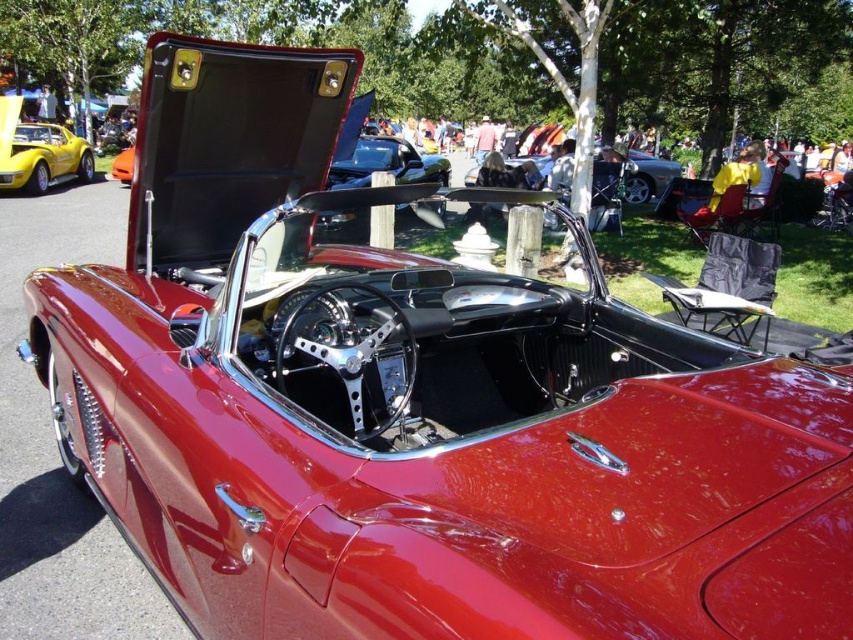
You are a photographer at the car show and want to capture both the shiny yellow convertible at left and the shiny black convertible at center in a single wide shot. Given their sizes, will you need to adjust your camera angle to include both?

The shiny yellow convertible at left occupies less space than the shiny black convertible at center. To capture both in a single wide shot, you may need to adjust your camera angle to accommodate the larger size of the shiny black convertible at center.

You are a photographer at the car show and want to capture both the shiny yellow convertible at left and the shiny black convertible at center in a single shot. Based on their positions, which convertible is higher up in the frame?

The shiny yellow convertible at left is located above the shiny black convertible at center, so it will appear higher up in the frame.